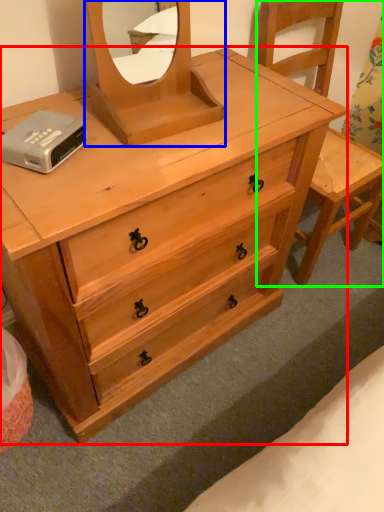
Question: Which object is the closest to the chest of drawers (highlighted by a red box)? Choose among these: mirror (highlighted by a blue box) or armchair (highlighted by a green box).

Choices:
 (A) mirror
 (B) armchair

Answer: (A)